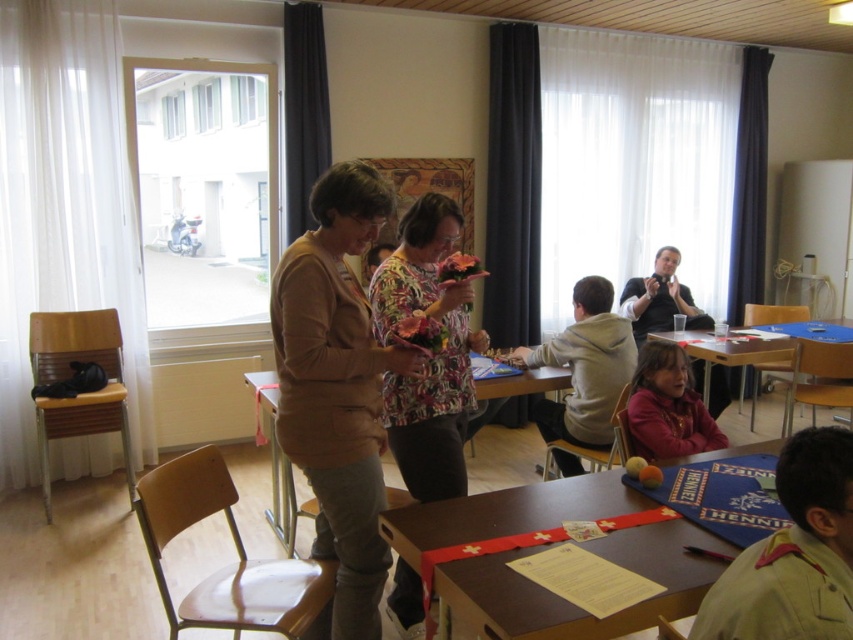
Question: Considering the real-world distances, which object is closest to the dark gray fabric curtain at upper center?

Choices:
 (A) white sheer curtain at left
 (B) matte brown jacket at center
 (C) floral print blouse at center

Answer: (A)

Question: Is matte brown jacket at center bigger than khaki uniform shirt at lower right?

Choices:
 (A) yes
 (B) no

Answer: (A)

Question: Is wooden table at lower center above floral print blouse at center?

Choices:
 (A) yes
 (B) no

Answer: (B)

Question: Which point is closer to the camera?

Choices:
 (A) (399, 236)
 (B) (287, 481)
 (C) (68, 45)
 (D) (822, 444)

Answer: (D)

Question: Considering the real-world distances, which object is farthest from the white sheer curtain at right?

Choices:
 (A) wooden table at lower center
 (B) dark gray fabric curtain at upper center

Answer: (A)

Question: Does wooden table at lower center come behind light gray hoodie at center?

Choices:
 (A) yes
 (B) no

Answer: (B)